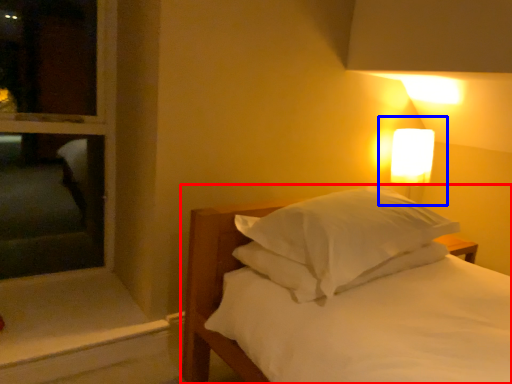
Question: Which object is closer to the camera taking this photo, bed (highlighted by a red box) or bedside lamp (highlighted by a blue box)?

Choices:
 (A) bed
 (B) bedside lamp

Answer: (A)